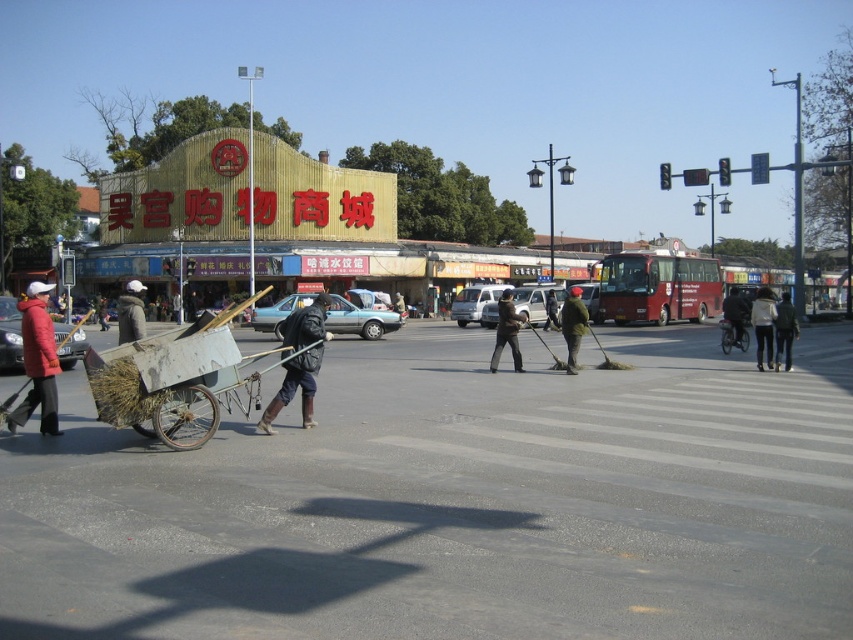
Who is lower down, wooden cart at center or black leather jacket at center?

black leather jacket at center is lower down.

The image size is (853, 640). I want to click on wooden cart at center, so click(x=178, y=380).

Does matte red coat at lower left have a lesser width compared to dark green uniform at center?

No.

Between matte red coat at lower left and dark green uniform at center, which one has more height?

With more height is matte red coat at lower left.

Who is more forward, (38, 369) or (550, 294)?

Positioned in front is point (38, 369).

At what (x,y) coordinates should I click in order to perform the action: click on matte red coat at lower left. Please return your answer as a coordinate pair (x, y). Looking at the image, I should click on (38, 362).

Does dark gray fabric jacket at center-left appear on the right side of dark green uniform at center?

Incorrect, dark gray fabric jacket at center-left is not on the right side of dark green uniform at center.

Can you confirm if dark gray fabric jacket at center-left is positioned to the left of dark green uniform at center?

Correct, you'll find dark gray fabric jacket at center-left to the left of dark green uniform at center.

Who is more forward, [143,289] or [547,308]?

Point [547,308]

Where is `dark gray fabric jacket at center-left`? dark gray fabric jacket at center-left is located at coordinates (131, 312).